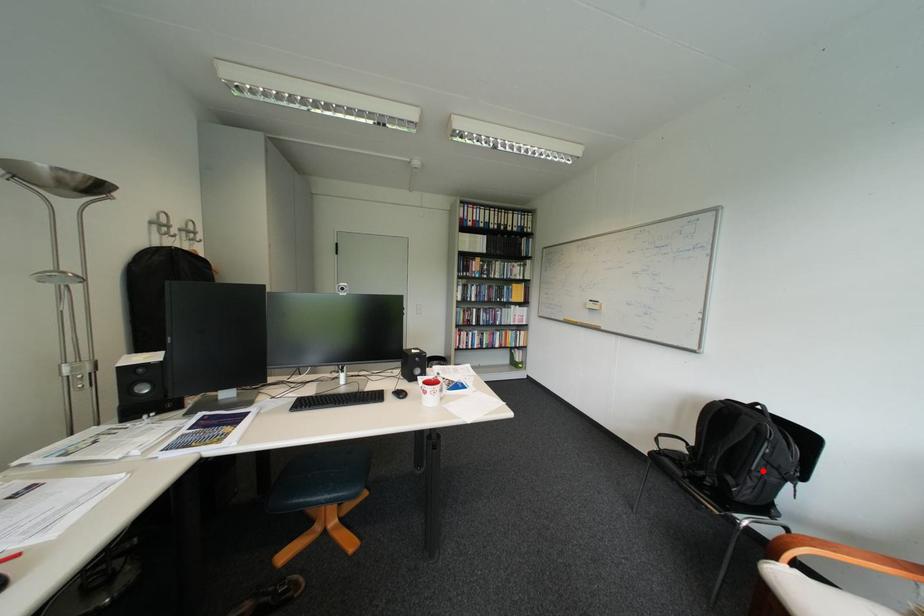
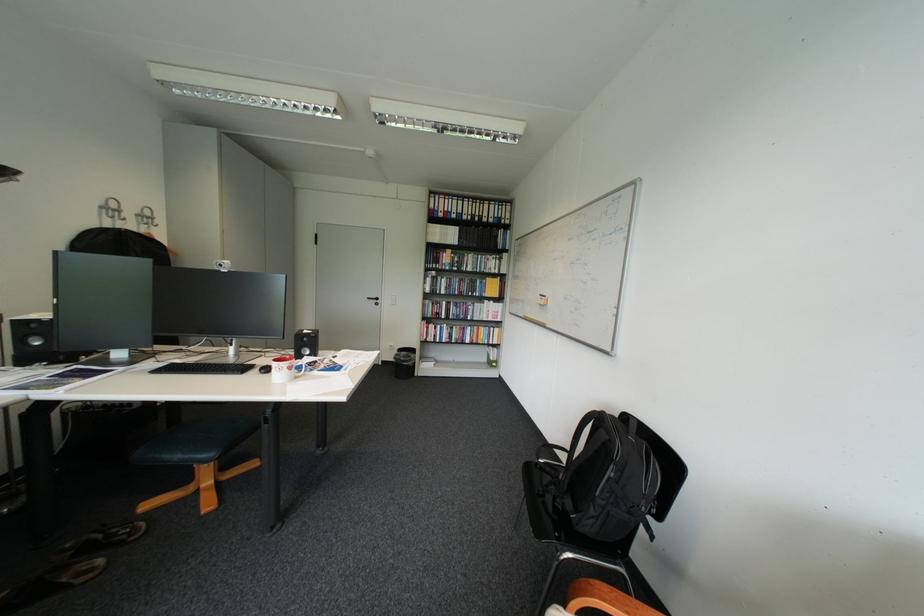
Question: A red point is marked in image1. In image2, is the corresponding 3D point closer to the camera or farther? Reply with the corresponding letter.

Choices:
 (A) The corresponding 3D point is closer.
 (B) The corresponding 3D point is farther.

Answer: (B)